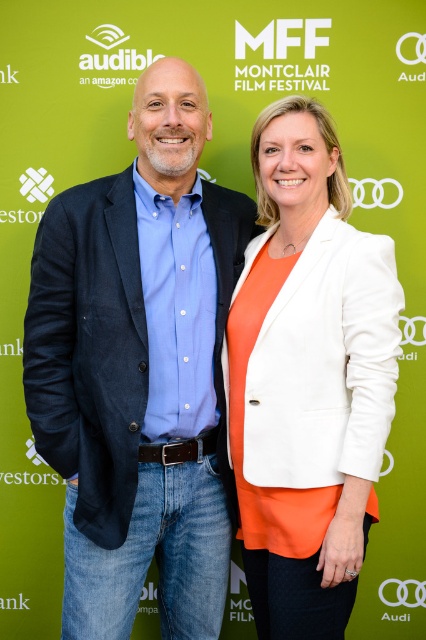
You are a photographer setting up for a portrait session. You notice the blue denim jeans at center and the white matte blazer at center in the scene. Which object is closer to you, the photographer?

The blue denim jeans at center is closer to the photographer than the white matte blazer at center because it is further to the viewer.

Looking at this image, you are a photographer setting up for a group photo. You notice the blue denim jeans at center and the white matte blazer at center in the scene. Which clothing item takes up more visual space in the image?

The blue denim jeans at center is bigger than the white matte blazer at center, so the blue denim jeans at center takes up more visual space in the image.

You are a photographer setting up for a group photo. You notice the blue denim jeans at center and the white matte blazer at center in the scene. Which object is taller?

The blue denim jeans at center is much taller than the white matte blazer at center.